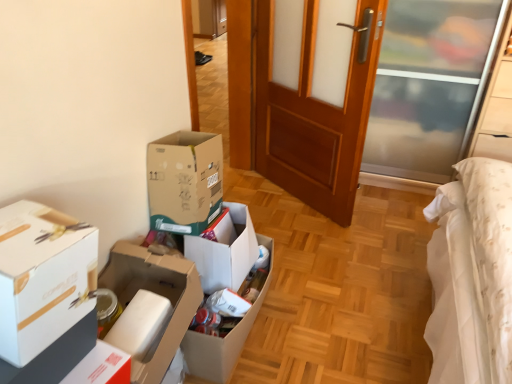
Question: From the image's perspective, would you say wooden door at center is positioned over cardboard box at center, the first box when ordered from back to front?

Choices:
 (A) yes
 (B) no

Answer: (A)

Question: Is wooden door at center positioned far away from cardboard box at center, the first box when ordered from back to front?

Choices:
 (A) no
 (B) yes

Answer: (B)

Question: From the image's perspective, does wooden door at center appear lower than cardboard box at center, the first box when ordered from back to front?

Choices:
 (A) no
 (B) yes

Answer: (A)

Question: Considering the relative positions of wooden door at center and cardboard box at center, positioned as the third box in front-to-back order, in the image provided, is wooden door at center in front of cardboard box at center, positioned as the third box in front-to-back order,?

Choices:
 (A) yes
 (B) no

Answer: (B)

Question: Is wooden door at center aimed at cardboard box at center, positioned as the third box in front-to-back order?

Choices:
 (A) yes
 (B) no

Answer: (A)

Question: Is wooden door at center behind cardboard box at center, positioned as the third box in front-to-back order?

Choices:
 (A) no
 (B) yes

Answer: (B)

Question: Can you confirm if white cardboard box at center, positioned as the 2th box in back-to-front order, is positioned to the left of wooden door at center?

Choices:
 (A) no
 (B) yes

Answer: (B)

Question: Is white cardboard box at center, positioned as the 2th box in back-to-front order, completely or partially outside of wooden door at center?

Choices:
 (A) yes
 (B) no

Answer: (A)

Question: From the image's perspective, is white cardboard box at center, positioned as the 2th box in back-to-front order, above wooden door at center?

Choices:
 (A) yes
 (B) no

Answer: (B)

Question: Does white cardboard box at center, the second box when ordered from front to back, come behind wooden door at center?

Choices:
 (A) yes
 (B) no

Answer: (B)

Question: From the image's perspective, is white cardboard box at center, positioned as the 2th box in back-to-front order, under wooden door at center?

Choices:
 (A) no
 (B) yes

Answer: (B)

Question: Can you confirm if white cardboard box at center, positioned as the 2th box in back-to-front order, is wider than wooden door at center?

Choices:
 (A) yes
 (B) no

Answer: (A)

Question: From the image's perspective, is cardboard box at center, the first box when ordered from back to front, located beneath wooden door at center?

Choices:
 (A) no
 (B) yes

Answer: (B)